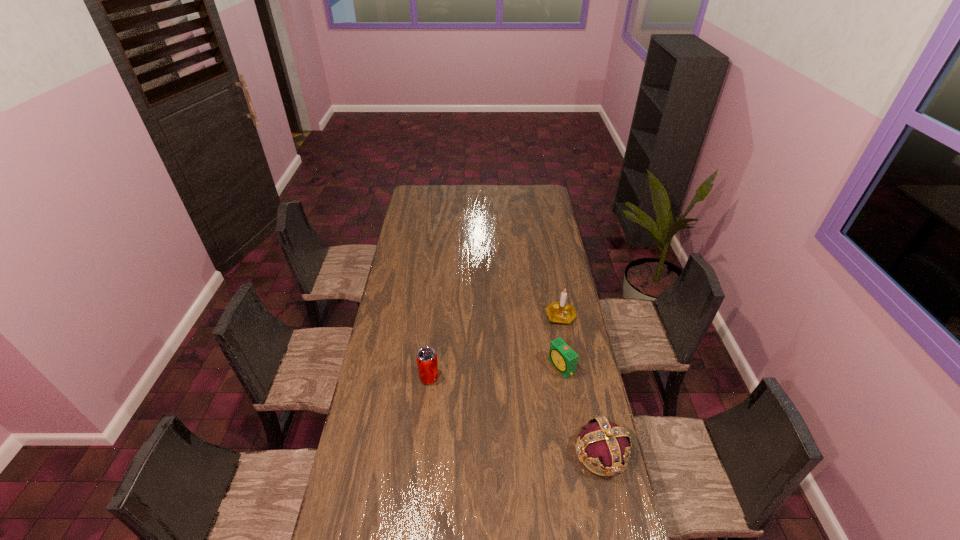
Locate which object is the third closest to the leftmost object. Please provide its 2D coordinates. Your answer should be formatted as a tuple, i.e. [(x, y)], where the tuple contains the x and y coordinates of a point satisfying the conditions above.

[(561, 312)]

Image resolution: width=960 pixels, height=540 pixels. Find the location of `free space that satisfies the following two spatial constraints: 1. on the back side of the candle holder; 2. on the left side of the soda can`. free space that satisfies the following two spatial constraints: 1. on the back side of the candle holder; 2. on the left side of the soda can is located at coordinates (436, 315).

What are the coordinates of `free space that satisfies the following two spatial constraints: 1. on the front side of the crown; 2. on the right side of the shortest object` in the screenshot? It's located at (576, 453).